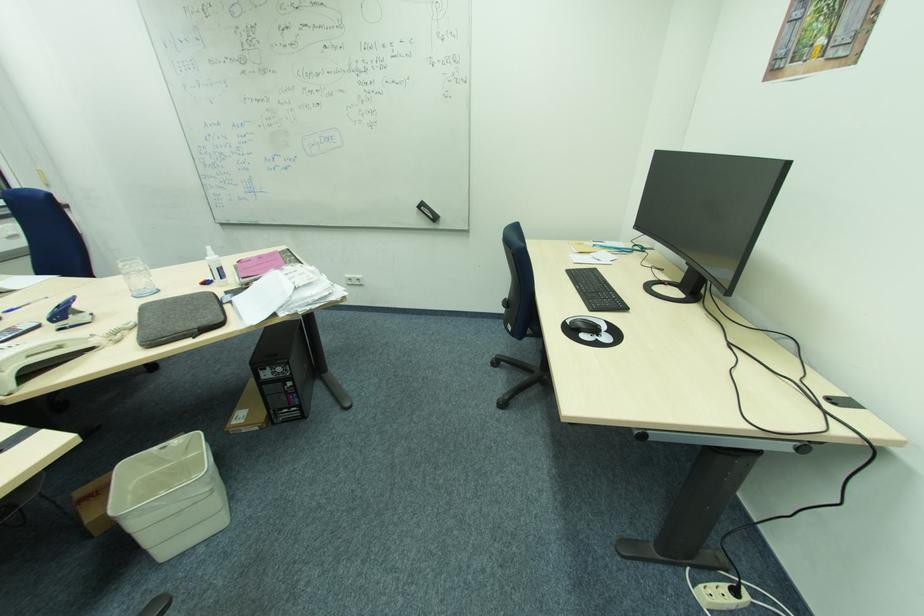
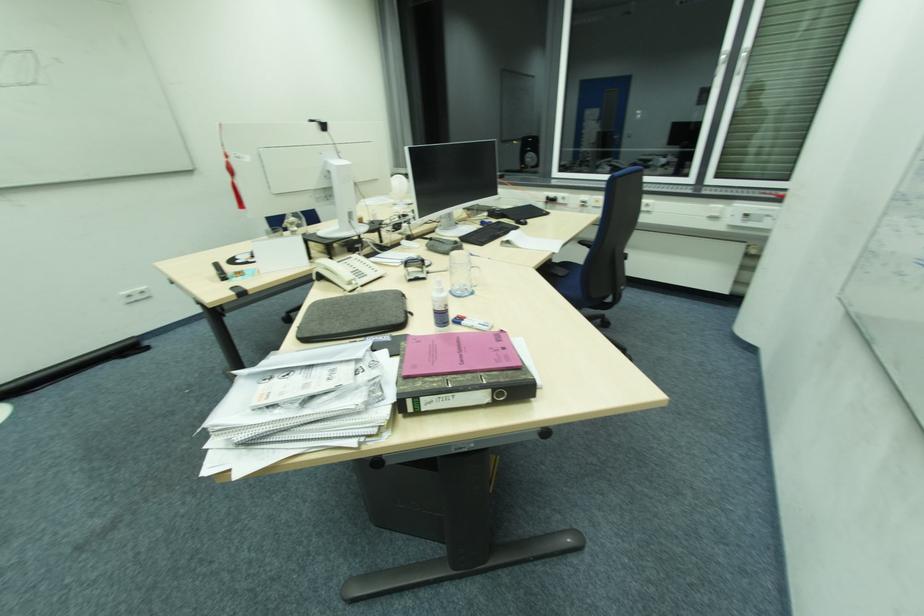
Locate, in the second image, the point that corresponds to the point at 221,268 in the first image.

(436, 310)